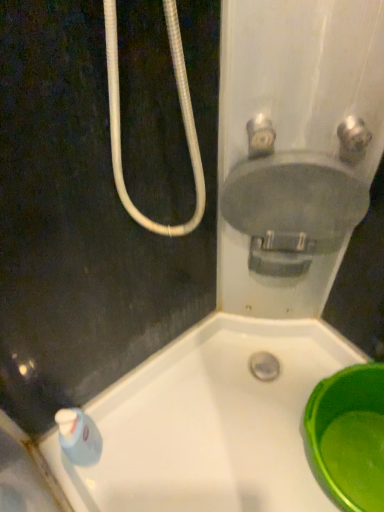
Describe the element at coordinates (260, 136) in the screenshot. I see `matte gray valve at upper right, which ranks as the 1th plumbing fixture in left-to-right order` at that location.

Find the location of a particular element. Image resolution: width=384 pixels, height=512 pixels. green plastic basin at lower right is located at coordinates (348, 436).

Locate an element on the screen. The width and height of the screenshot is (384, 512). matte gray valve at upper right, which ranks as the 1th plumbing fixture in left-to-right order is located at coordinates (260, 136).

Consider the image. Is matte gray sink at upper right looking in the opposite direction of satin nickel faucet at upper right, which is the second plumbing fixture in left-to-right order?

matte gray sink at upper right does not have its back to satin nickel faucet at upper right, which is the second plumbing fixture in left-to-right order.

Is matte gray sink at upper right touching satin nickel faucet at upper right, which is the second plumbing fixture in left-to-right order?

matte gray sink at upper right is not next to satin nickel faucet at upper right, which is the second plumbing fixture in left-to-right order, and they're not touching.

Looking at this image, considering the relative sizes of matte gray sink at upper right and satin nickel faucet at upper right, the first plumbing fixture in the right-to-left sequence, in the image provided, is matte gray sink at upper right shorter than satin nickel faucet at upper right, the first plumbing fixture in the right-to-left sequence,?

In fact, matte gray sink at upper right may be taller than satin nickel faucet at upper right, the first plumbing fixture in the right-to-left sequence.

From a real-world perspective, is matte gray sink at upper right above or below satin nickel faucet at upper right, the first plumbing fixture in the right-to-left sequence?

matte gray sink at upper right is situated lower than satin nickel faucet at upper right, the first plumbing fixture in the right-to-left sequence, in the real world.

Is green plastic basin at lower right looking in the opposite direction of matte gray valve at upper right, acting as the second plumbing fixture starting from the right?

No.

Is green plastic basin at lower right bigger or smaller than matte gray valve at upper right, which ranks as the 1th plumbing fixture in left-to-right order?

Considering their sizes, green plastic basin at lower right takes up more space than matte gray valve at upper right, which ranks as the 1th plumbing fixture in left-to-right order.

Would you consider matte gray valve at upper right, acting as the second plumbing fixture starting from the right, to be distant from satin nickel faucet at upper right, which is the second plumbing fixture in left-to-right order?

No.

From the image's perspective, which object appears higher, matte gray valve at upper right, acting as the second plumbing fixture starting from the right, or satin nickel faucet at upper right, the first plumbing fixture in the right-to-left sequence?

matte gray valve at upper right, acting as the second plumbing fixture starting from the right, is shown above in the image.

Can you tell me how much matte gray valve at upper right, which ranks as the 1th plumbing fixture in left-to-right order, and satin nickel faucet at upper right, which is the second plumbing fixture in left-to-right order, differ in facing direction?

The angle between the facing direction of matte gray valve at upper right, which ranks as the 1th plumbing fixture in left-to-right order, and the facing direction of satin nickel faucet at upper right, which is the second plumbing fixture in left-to-right order, is 0.00257 degrees.

Which is behind, point (265, 125) or point (344, 156)?

The point (344, 156) is farther.

Between point (363, 124) and point (266, 123), which one is positioned behind?

The point (363, 124) is farther.

Consider the image. From the image's perspective, is satin nickel faucet at upper right, which is the second plumbing fixture in left-to-right order, over matte gray valve at upper right, acting as the second plumbing fixture starting from the right?

Incorrect, from the image's perspective, satin nickel faucet at upper right, which is the second plumbing fixture in left-to-right order, is lower than matte gray valve at upper right, acting as the second plumbing fixture starting from the right.

In the scene shown: Is satin nickel faucet at upper right, the first plumbing fixture in the right-to-left sequence, facing away from matte gray valve at upper right, which ranks as the 1th plumbing fixture in left-to-right order?

No.

How distant is satin nickel faucet at upper right, the first plumbing fixture in the right-to-left sequence, from matte gray valve at upper right, acting as the second plumbing fixture starting from the right?

satin nickel faucet at upper right, the first plumbing fixture in the right-to-left sequence, and matte gray valve at upper right, acting as the second plumbing fixture starting from the right, are 5.67 inches apart.

Is matte gray sink at upper right outside of green plastic basin at lower right?

matte gray sink at upper right lies outside green plastic basin at lower right's area.

At what (x,y) coordinates should I click in order to perform the action: click on sink that appears in front of the green plastic basin at lower right. Please return your answer as a coordinate pair (x, y). Looking at the image, I should click on (295, 198).

Which object is positioned more to the left, matte gray sink at upper right or green plastic basin at lower right?

Positioned to the left is matte gray sink at upper right.

Considering the relative sizes of matte gray sink at upper right and green plastic basin at lower right in the image provided, is matte gray sink at upper right bigger than green plastic basin at lower right?

Incorrect, matte gray sink at upper right is not larger than green plastic basin at lower right.

Between satin nickel faucet at upper right, which is the second plumbing fixture in left-to-right order, and matte gray sink at upper right, which one has more height?

Standing taller between the two is matte gray sink at upper right.

The image size is (384, 512). In order to click on plumbing fixture on the right of matte gray sink at upper right in this screenshot , I will do `click(353, 140)`.

Does satin nickel faucet at upper right, the first plumbing fixture in the right-to-left sequence, have a smaller size compared to matte gray sink at upper right?

Yes, satin nickel faucet at upper right, the first plumbing fixture in the right-to-left sequence, is smaller than matte gray sink at upper right.

Which is in front, point (360, 152) or point (250, 122)?

The point (250, 122) is more forward.

In the scene shown: Is matte gray valve at upper right, acting as the second plumbing fixture starting from the right, in front of matte gray sink at upper right?

Yes, it is in front of matte gray sink at upper right.

Is matte gray valve at upper right, which ranks as the 1th plumbing fixture in left-to-right order, oriented towards matte gray sink at upper right?

No, matte gray valve at upper right, which ranks as the 1th plumbing fixture in left-to-right order, is not facing towards matte gray sink at upper right.

How many degrees apart are the facing directions of matte gray valve at upper right, which ranks as the 1th plumbing fixture in left-to-right order, and matte gray sink at upper right?

There is a 0.00338-degree angle between the facing directions of matte gray valve at upper right, which ranks as the 1th plumbing fixture in left-to-right order, and matte gray sink at upper right.

Which is nearer, (x=269, y=129) or (x=312, y=180)?

Point (x=269, y=129) is closer to the camera than point (x=312, y=180).

The height and width of the screenshot is (512, 384). In order to click on sink below the satin nickel faucet at upper right, which is the second plumbing fixture in left-to-right order (from a real-world perspective) in this screenshot , I will do `click(295, 198)`.

Where is `the 1st plumbing fixture in front of the green plastic basin at lower right`? The width and height of the screenshot is (384, 512). the 1st plumbing fixture in front of the green plastic basin at lower right is located at coordinates (260, 136).

Looking at the image, which one is located further to satin nickel faucet at upper right, which is the second plumbing fixture in left-to-right order, matte gray sink at upper right or matte gray valve at upper right, acting as the second plumbing fixture starting from the right?

matte gray valve at upper right, acting as the second plumbing fixture starting from the right, is further to satin nickel faucet at upper right, which is the second plumbing fixture in left-to-right order.

Which object lies nearer to the anchor point green plastic basin at lower right, matte gray valve at upper right, acting as the second plumbing fixture starting from the right, or satin nickel faucet at upper right, which is the second plumbing fixture in left-to-right order?

Based on the image, satin nickel faucet at upper right, which is the second plumbing fixture in left-to-right order, appears to be nearer to green plastic basin at lower right.

From the image, which object appears to be nearer to matte gray valve at upper right, which ranks as the 1th plumbing fixture in left-to-right order, satin nickel faucet at upper right, which is the second plumbing fixture in left-to-right order, or matte gray sink at upper right?

Among the two, matte gray sink at upper right is located nearer to matte gray valve at upper right, which ranks as the 1th plumbing fixture in left-to-right order.

Considering their positions, is matte gray valve at upper right, which ranks as the 1th plumbing fixture in left-to-right order, positioned closer to green plastic basin at lower right than matte gray sink at upper right?

matte gray sink at upper right lies closer to green plastic basin at lower right than the other object.

When comparing their distances from satin nickel faucet at upper right, which is the second plumbing fixture in left-to-right order, does matte gray valve at upper right, which ranks as the 1th plumbing fixture in left-to-right order, or matte gray sink at upper right seem further?

matte gray valve at upper right, which ranks as the 1th plumbing fixture in left-to-right order, is further to satin nickel faucet at upper right, which is the second plumbing fixture in left-to-right order.

Which object lies further to the anchor point matte gray valve at upper right, acting as the second plumbing fixture starting from the right, matte gray sink at upper right or green plastic basin at lower right?

Based on the image, green plastic basin at lower right appears to be further to matte gray valve at upper right, acting as the second plumbing fixture starting from the right.

Consider the image. Based on their spatial positions, is matte gray sink at upper right or satin nickel faucet at upper right, which is the second plumbing fixture in left-to-right order, further from green plastic basin at lower right?

Based on the image, satin nickel faucet at upper right, which is the second plumbing fixture in left-to-right order, appears to be further to green plastic basin at lower right.

Estimate the real-world distances between objects in this image. Which object is closer to matte gray sink at upper right, matte gray valve at upper right, which ranks as the 1th plumbing fixture in left-to-right order, or green plastic basin at lower right?

matte gray valve at upper right, which ranks as the 1th plumbing fixture in left-to-right order.

At what (x,y) coordinates should I click in order to perform the action: click on plumbing fixture between matte gray valve at upper right, which ranks as the 1th plumbing fixture in left-to-right order, and green plastic basin at lower right from top to bottom. Please return your answer as a coordinate pair (x, y). The image size is (384, 512). Looking at the image, I should click on (353, 140).

The width and height of the screenshot is (384, 512). Find the location of `sink between satin nickel faucet at upper right, the first plumbing fixture in the right-to-left sequence, and green plastic basin at lower right in the up-down direction`. sink between satin nickel faucet at upper right, the first plumbing fixture in the right-to-left sequence, and green plastic basin at lower right in the up-down direction is located at coordinates (295, 198).

The width and height of the screenshot is (384, 512). In order to click on sink between matte gray valve at upper right, which ranks as the 1th plumbing fixture in left-to-right order, and green plastic basin at lower right from top to bottom in this screenshot , I will do `click(295, 198)`.

Locate an element on the screen. plumbing fixture between matte gray valve at upper right, which ranks as the 1th plumbing fixture in left-to-right order, and matte gray sink at upper right vertically is located at coordinates (353, 140).